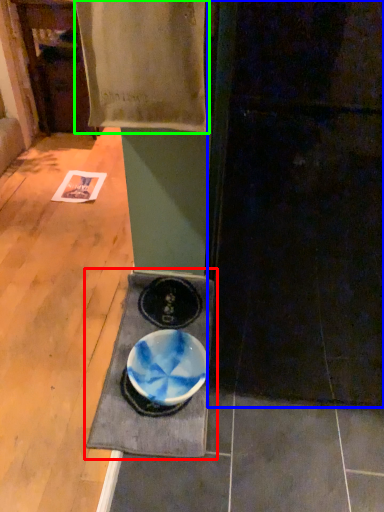
Question: Based on their relative distances, which object is farther from table (highlighted by a red box)? Choose from door (highlighted by a blue box) and blanket (highlighted by a green box).

Choices:
 (A) door
 (B) blanket

Answer: (B)